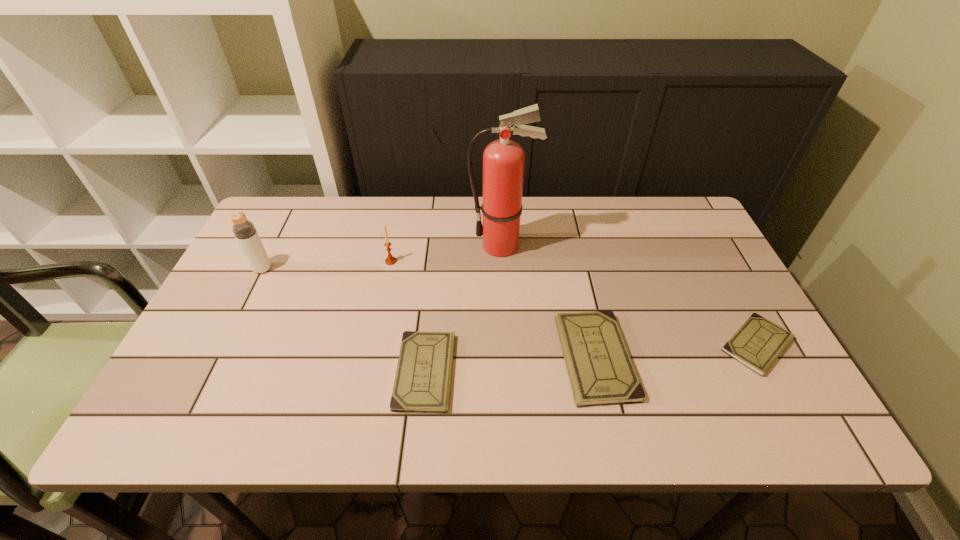
Identify the location of vacant point located between the bottle and the fifth tallest object. (344, 320).

Where is `free area in between the third tallest object and the fourth object from right to left`? The width and height of the screenshot is (960, 540). free area in between the third tallest object and the fourth object from right to left is located at coordinates (408, 316).

Where is `free point between the tallest checkbook and the rightmost checkbook`? The width and height of the screenshot is (960, 540). free point between the tallest checkbook and the rightmost checkbook is located at coordinates (676, 352).

The width and height of the screenshot is (960, 540). I want to click on free point between the second object from right to left and the fifth object from right to left, so click(x=493, y=309).

You are a GUI agent. You are given a task and a screenshot of the screen. Output one action in this format:
    pyautogui.click(x=<x>, y=<y>)
    Task: Click on the free space that is in between the fourth tallest object and the fifth tallest object
    
    Given the screenshot: What is the action you would take?
    pyautogui.click(x=510, y=364)

You are a GUI agent. You are given a task and a screenshot of the screen. Output one action in this format:
    pyautogui.click(x=<x>, y=<y>)
    Task: Click on the unoccupied position between the tallest checkbook and the fire extinguisher
    
    Given the screenshot: What is the action you would take?
    pyautogui.click(x=548, y=302)

You are a GUI agent. You are given a task and a screenshot of the screen. Output one action in this format:
    pyautogui.click(x=<x>, y=<y>)
    Task: Click on the free spot between the shortest object and the tallest checkbook
    The image size is (960, 540).
    Given the screenshot: What is the action you would take?
    pyautogui.click(x=676, y=352)

You are a GUI agent. You are given a task and a screenshot of the screen. Output one action in this format:
    pyautogui.click(x=<x>, y=<y>)
    Task: Click on the unoccupied area between the fourth object from left to right and the candle_holder
    
    Given the screenshot: What is the action you would take?
    pyautogui.click(x=446, y=253)

Find the location of `vacant point located between the fifth shortest object and the rightmost checkbook`. vacant point located between the fifth shortest object and the rightmost checkbook is located at coordinates click(x=510, y=307).

The image size is (960, 540). Identify the location of vacant space that is in between the third object from left to right and the second tallest object. (344, 320).